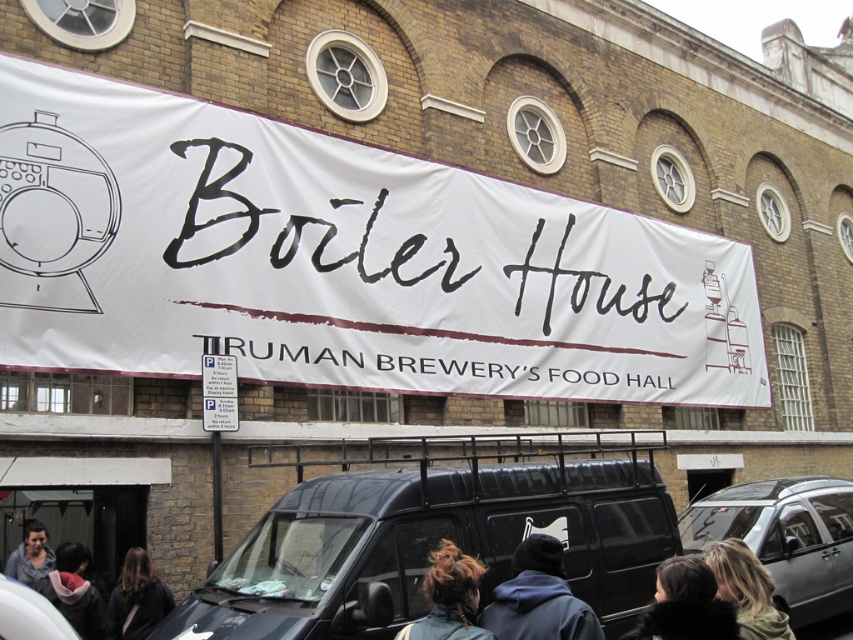
Question: Which of these objects is positioned closest to the silver metallic car at lower right?

Choices:
 (A) black fur coat at lower center
 (B) dark gray hoodie at lower left

Answer: (A)

Question: Among these points, which one is nearest to the camera?

Choices:
 (A) (207, 410)
 (B) (131, 621)

Answer: (B)

Question: Is black matte van at center positioned behind brown hair at center?

Choices:
 (A) yes
 (B) no

Answer: (A)

Question: Does dark gray hoodie at lower left have a larger size compared to black matte van at lower left?

Choices:
 (A) no
 (B) yes

Answer: (B)

Question: Estimate the real-world distances between objects in this image. Which object is closer to the white paper sign at center?

Choices:
 (A) black matte van at lower left
 (B) dark brown hair at lower left
 (C) dark blue hoodie at center
 (D) white paper banner at center

Answer: (B)

Question: Does black matte van at center have a smaller size compared to brown hair at center?

Choices:
 (A) no
 (B) yes

Answer: (A)